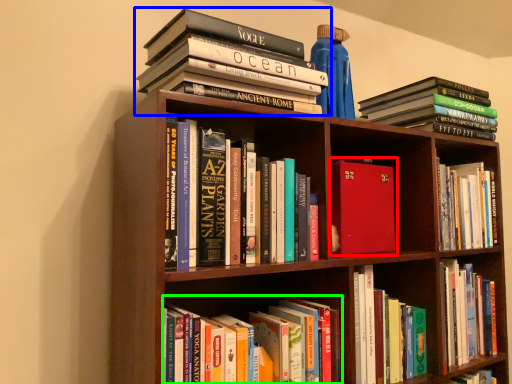
Question: Which object is positioned closest to book (highlighted by a red box)? Select from book (highlighted by a blue box) and book (highlighted by a green box).

Choices:
 (A) book
 (B) book

Answer: (B)